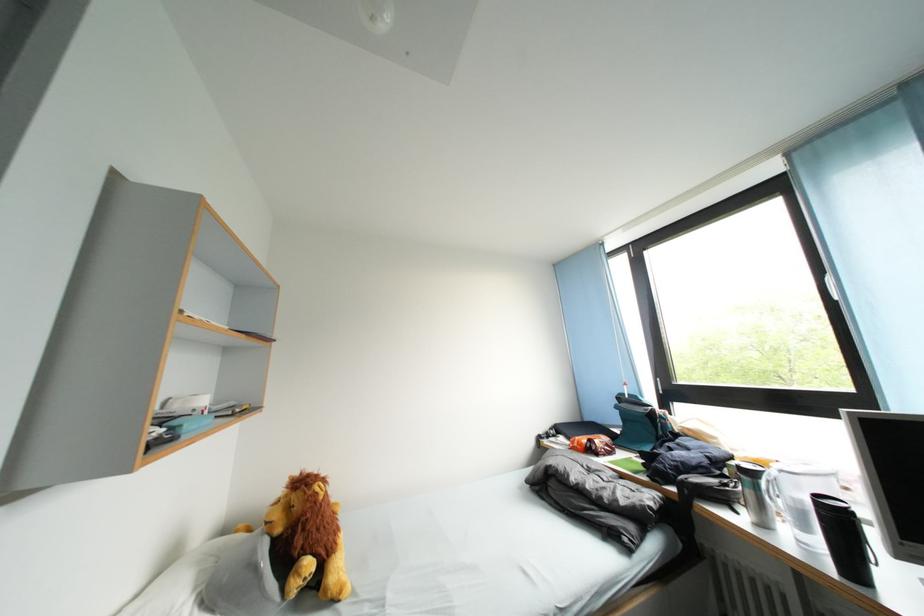
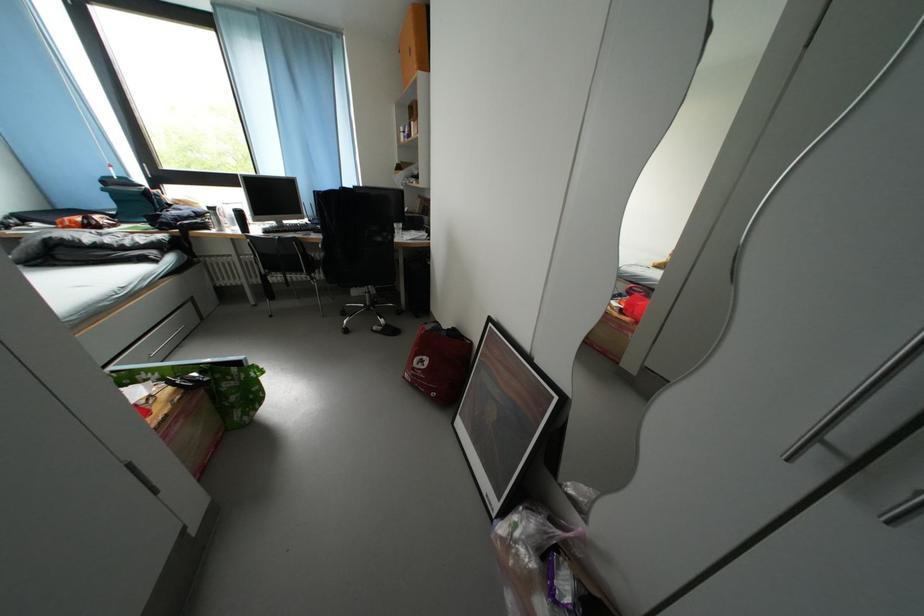
Find the pixel in the second image that matches (x=839, y=575) in the first image.

(248, 238)